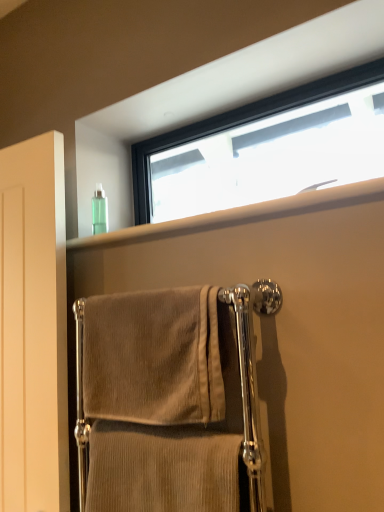
Question: Is the position of clear plastic bottle at upper center less distant than that of black frame window at upper center?

Choices:
 (A) yes
 (B) no

Answer: (A)

Question: Does clear plastic bottle at upper center appear on the right side of black frame window at upper center?

Choices:
 (A) yes
 (B) no

Answer: (B)

Question: From the image's perspective, is clear plastic bottle at upper center over black frame window at upper center?

Choices:
 (A) yes
 (B) no

Answer: (B)

Question: Is clear plastic bottle at upper center turned away from black frame window at upper center?

Choices:
 (A) no
 (B) yes

Answer: (A)

Question: Considering the relative sizes of clear plastic bottle at upper center and black frame window at upper center in the image provided, is clear plastic bottle at upper center wider than black frame window at upper center?

Choices:
 (A) yes
 (B) no

Answer: (A)

Question: Considering the positions of green translucent bottle at upper left and clear plastic bottle at upper center in the image, is green translucent bottle at upper left taller or shorter than clear plastic bottle at upper center?

Choices:
 (A) tall
 (B) short

Answer: (A)

Question: Do you think green translucent bottle at upper left is within clear plastic bottle at upper center, or outside of it?

Choices:
 (A) outside
 (B) inside

Answer: (A)

Question: Is green translucent bottle at upper left to the left or to the right of clear plastic bottle at upper center in the image?

Choices:
 (A) right
 (B) left

Answer: (B)

Question: In terms of width, does green translucent bottle at upper left look wider or thinner when compared to clear plastic bottle at upper center?

Choices:
 (A) thin
 (B) wide

Answer: (A)

Question: Is clear plastic bottle at upper center situated inside beige corduroy towel at center, marked as the 1th towel in a top-to-bottom arrangement, or outside?

Choices:
 (A) inside
 (B) outside

Answer: (B)

Question: Considering their positions, is clear plastic bottle at upper center located in front of or behind beige corduroy towel at center, marked as the 1th towel in a top-to-bottom arrangement?

Choices:
 (A) front
 (B) behind

Answer: (B)

Question: Looking at their shapes, would you say clear plastic bottle at upper center is wider or thinner than beige corduroy towel at center, the 2th towel in the bottom-to-top sequence?

Choices:
 (A) wide
 (B) thin

Answer: (A)

Question: Considering the positions of point (213, 225) and point (155, 390), is point (213, 225) closer or farther from the camera than point (155, 390)?

Choices:
 (A) closer
 (B) farther

Answer: (B)

Question: In the image, is beige corduroy towel at center, marked as the 1th towel in a top-to-bottom arrangement, positioned in front of or behind matte white door at left?

Choices:
 (A) behind
 (B) front

Answer: (B)

Question: From their relative heights in the image, would you say beige corduroy towel at center, the 2th towel in the bottom-to-top sequence, is taller or shorter than matte white door at left?

Choices:
 (A) short
 (B) tall

Answer: (A)